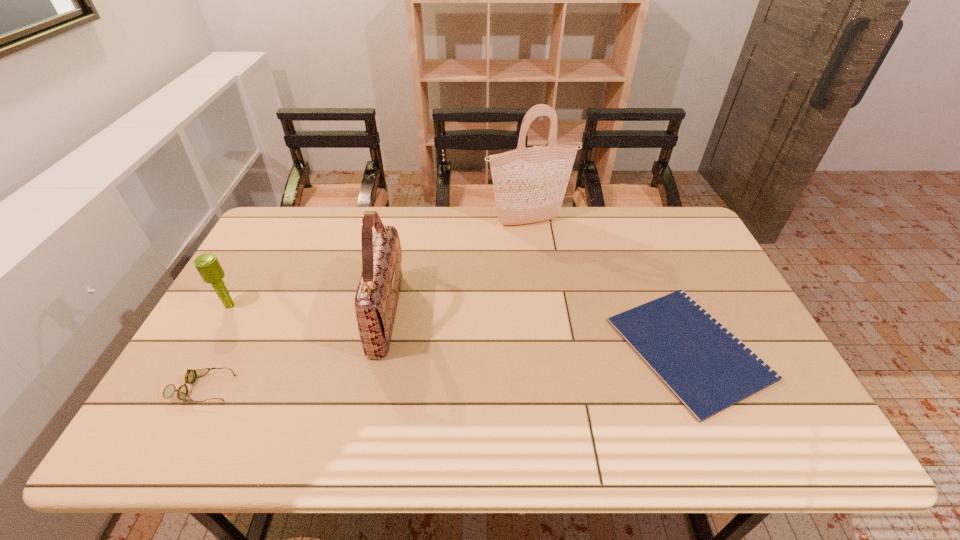
Where is `free region at the near edge`? The height and width of the screenshot is (540, 960). free region at the near edge is located at coordinates click(x=633, y=440).

The width and height of the screenshot is (960, 540). I want to click on vacant space at the left edge, so click(x=289, y=256).

The height and width of the screenshot is (540, 960). In the image, there is a desktop. What are the coordinates of `free space at the near left corner` in the screenshot? It's located at pyautogui.click(x=207, y=443).

Where is `vacant space at the far right corner`? The width and height of the screenshot is (960, 540). vacant space at the far right corner is located at coordinates (682, 245).

Locate an element on the screen. This screenshot has height=540, width=960. vacant area that lies between the shopping bag and the fourth shortest object is located at coordinates (458, 268).

The width and height of the screenshot is (960, 540). I want to click on empty space between the rightmost object and the fourth tallest object, so click(x=445, y=369).

The height and width of the screenshot is (540, 960). What are the coordinates of `vacant point located between the fourth shortest object and the spectacles` in the screenshot? It's located at (295, 351).

In order to click on free space between the shopping bag and the rightmost object in this screenshot , I will do `click(609, 285)`.

In order to click on free space between the handbag and the tallest object in this screenshot , I will do `click(458, 268)`.

Point out which object is positioned as the fourth nearest to the fourth object from left to right. Please provide its 2D coordinates. Your answer should be formatted as a tuple, i.e. [(x, y)], where the tuple contains the x and y coordinates of a point satisfying the conditions above.

[(191, 375)]